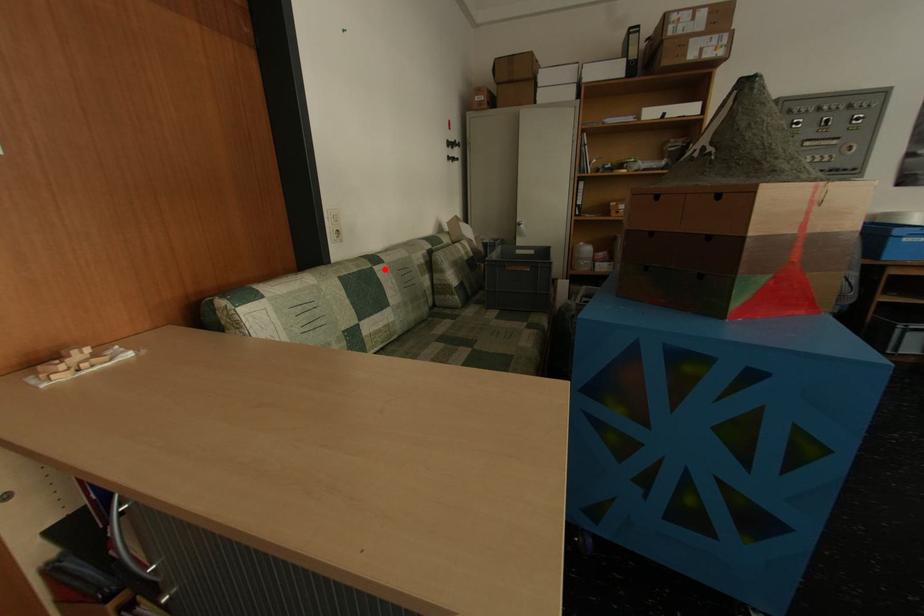
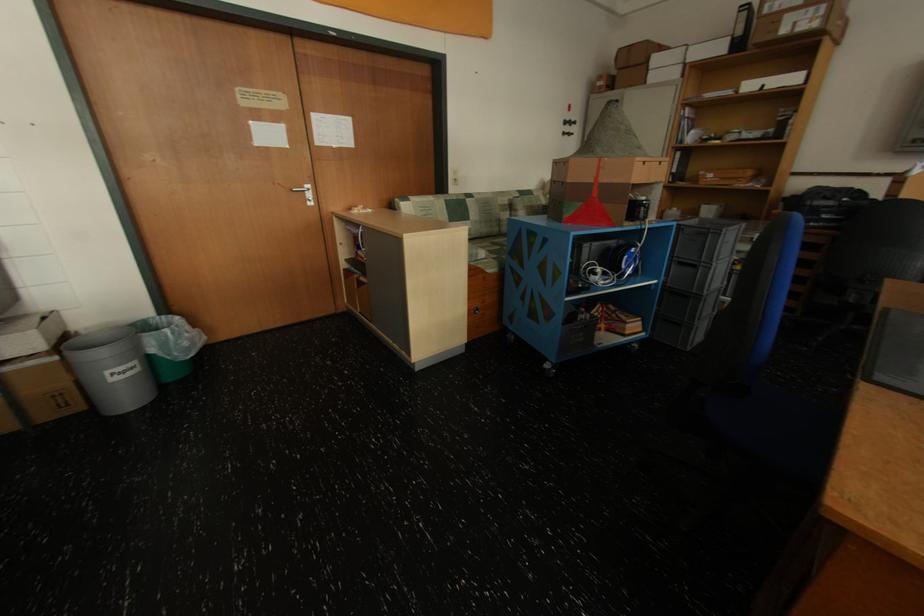
Locate, in the second image, the point that corresponds to the highlighted location in the first image.

(476, 201)